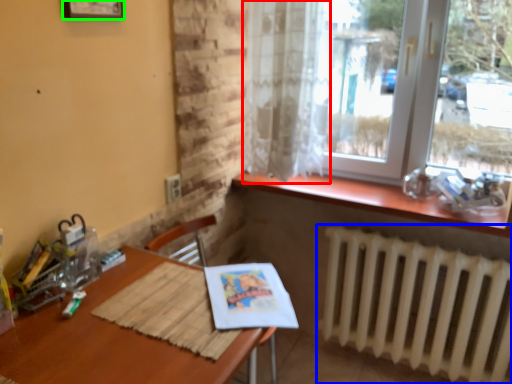
Question: Considering the real-world distances, which object is farthest from curtain (highlighted by a red box)? radiator (highlighted by a blue box) or picture frame (highlighted by a green box)?

Choices:
 (A) radiator
 (B) picture frame

Answer: (B)